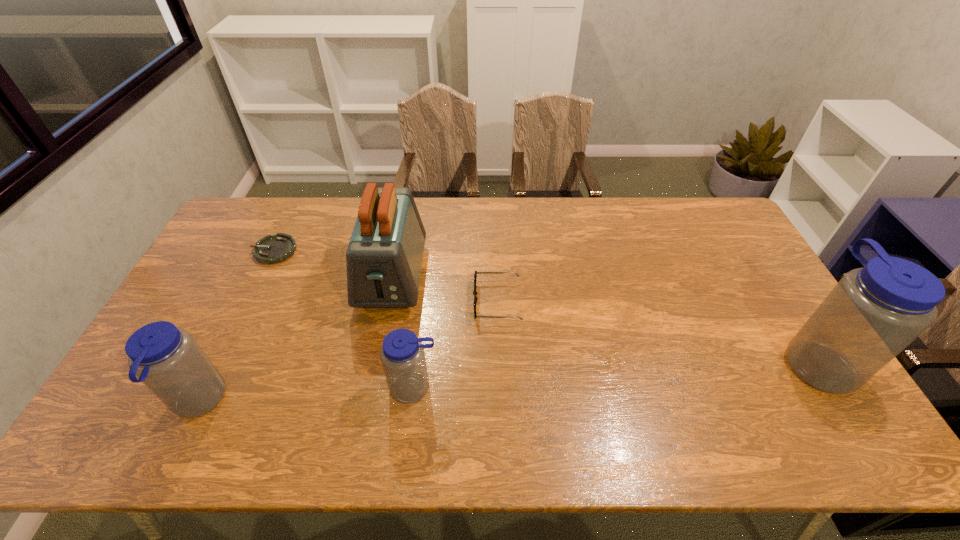
Please point a location where one more water_bottle can be added evenly. Please provide its 2D coordinates. Your answer should be formatted as a tuple, i.e. [(x, y)], where the tuple contains the x and y coordinates of a point satisfying the conditions above.

[(620, 374)]